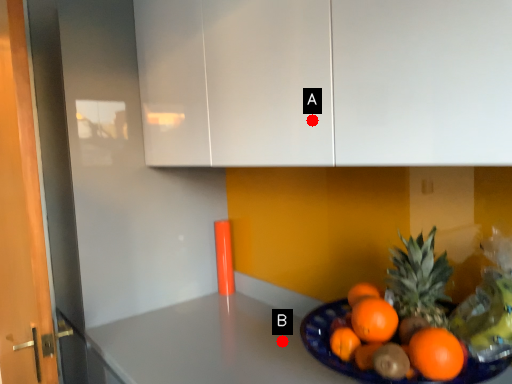
Question: Two points are circled on the image, labeled by A and B beside each circle. Which of the following is the farthest from the observer?

Choices:
 (A) A is further
 (B) B is further

Answer: (B)